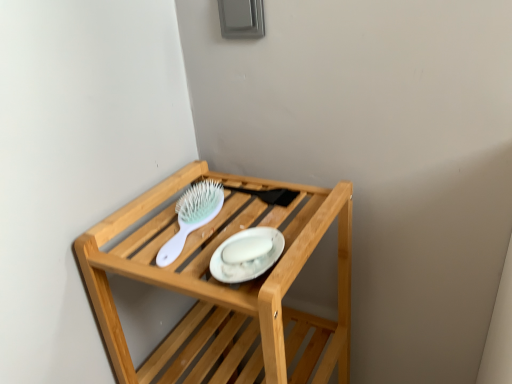
Question: Does wooden shelf at upper center lie behind white glossy platter at center?

Choices:
 (A) yes
 (B) no

Answer: (B)

Question: Is white glossy platter at center at the back of wooden shelf at upper center?

Choices:
 (A) yes
 (B) no

Answer: (B)

Question: Is wooden shelf at upper center smaller than white glossy platter at center?

Choices:
 (A) yes
 (B) no

Answer: (B)

Question: Is wooden shelf at upper center surrounding white glossy platter at center?

Choices:
 (A) yes
 (B) no

Answer: (A)

Question: Is wooden shelf at upper center at the left side of white glossy platter at center?

Choices:
 (A) no
 (B) yes

Answer: (B)

Question: Is wooden shelf at upper center to the right of white glossy platter at center from the viewer's perspective?

Choices:
 (A) yes
 (B) no

Answer: (B)

Question: Could you tell me if white plastic brush at upper center is facing white glossy platter at center?

Choices:
 (A) no
 (B) yes

Answer: (A)

Question: Is white plastic brush at upper center with white glossy platter at center?

Choices:
 (A) no
 (B) yes

Answer: (A)

Question: Considering the relative sizes of white plastic brush at upper center and white glossy platter at center in the image provided, is white plastic brush at upper center thinner than white glossy platter at center?

Choices:
 (A) yes
 (B) no

Answer: (B)

Question: From the image's perspective, is white plastic brush at upper center under white glossy platter at center?

Choices:
 (A) no
 (B) yes

Answer: (A)

Question: Can you confirm if white plastic brush at upper center is smaller than white glossy platter at center?

Choices:
 (A) yes
 (B) no

Answer: (B)

Question: Can you confirm if white plastic brush at upper center is taller than white glossy platter at center?

Choices:
 (A) no
 (B) yes

Answer: (B)

Question: From a real-world perspective, is white glossy platter at center physically below white plastic brush at upper center?

Choices:
 (A) yes
 (B) no

Answer: (B)